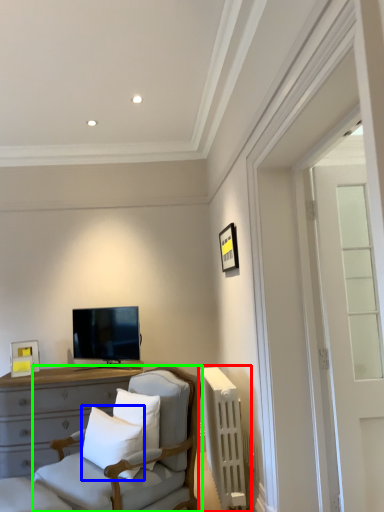
Question: Which object is the farthest from radiator (highlighted by a red box)? Choose among these: pillow (highlighted by a blue box) or chair (highlighted by a green box).

Choices:
 (A) pillow
 (B) chair

Answer: (A)